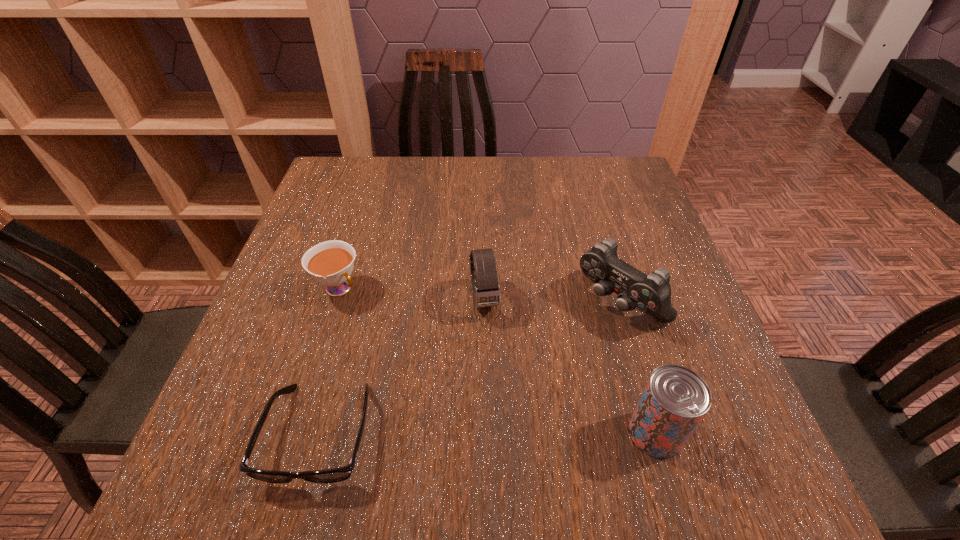
Identify the location of vacant space on the desktop that is between the shortest object and the beer can and is positioned on the face of the watch. The image size is (960, 540). (511, 433).

Where is `free space on the desktop that is between the shortest object and the beer can and is positioned on the side of the second shortest object with the handle`? The width and height of the screenshot is (960, 540). free space on the desktop that is between the shortest object and the beer can and is positioned on the side of the second shortest object with the handle is located at coordinates (511, 433).

You are a GUI agent. You are given a task and a screenshot of the screen. Output one action in this format:
    pyautogui.click(x=<x>, y=<y>)
    Task: Click on the vacant space on the desktop that is between the spectacles and the beer can and is positioned on the surface of the control with buttons
    The height and width of the screenshot is (540, 960).
    Given the screenshot: What is the action you would take?
    pyautogui.click(x=468, y=434)